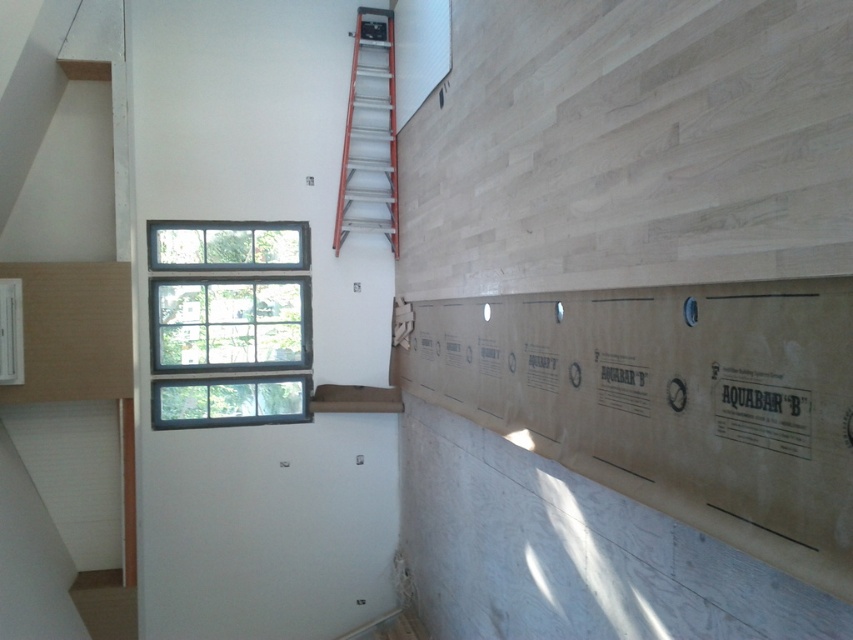
Who is positioned more to the right, clear glass window at upper left or orange fiberglass ladder at upper center?

orange fiberglass ladder at upper center is more to the right.

Describe the element at coordinates (229, 323) in the screenshot. I see `clear glass window at upper left` at that location.

Which is behind, point (223, 237) or point (396, 186)?

The point (396, 186) is behind.

This screenshot has width=853, height=640. Find the location of `clear glass window at upper left`. clear glass window at upper left is located at coordinates (229, 323).